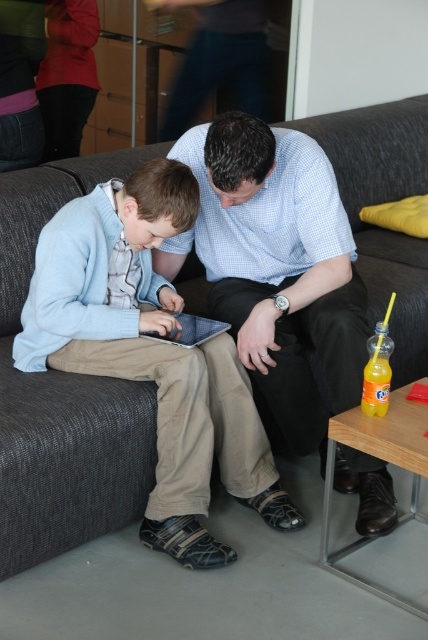
Consider the image. You are a photographer trying to capture a closeup of the tablet the boy is holding. You notice two points marked in the scene at coordinates point (110, 220) and point (235, 150). Which point should you focus on to ensure the tablet is in sharp focus?

Point (110, 220) is further to the camera than point (235, 150). Since the tablet is likely near the boy who is seated closer, focusing on point (110, 220) will ensure the tablet is in sharp focus.

You are a fashion designer observing the two individuals on the dark gray sofa. You need to determine which clothing item is shorter in height between the light blue sweater at center and the blue checkered shirt at center. Which one is shorter?

The light blue sweater at center has a lesser height compared to the blue checkered shirt at center, so the light blue sweater at center is shorter.

You are a photographer trying to capture a closeup of the light blue sweater at center without including the blue checkered shirt at center in the shot. Based on their positions, is this possible?

The blue checkered shirt at center is behind the light blue sweater at center, so you can take a closeup of the light blue sweater at center without the blue checkered shirt at center appearing in the frame by focusing on the front of the sweater.